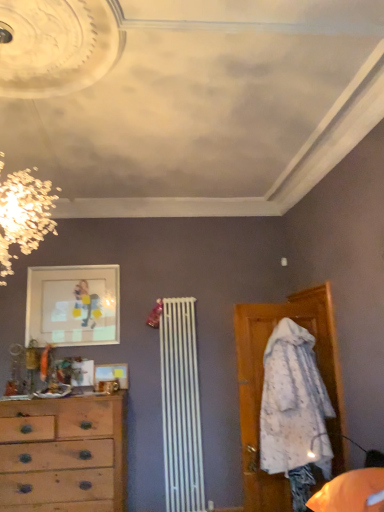
Question: Considering the positions of wooden picture frame at center, the 1th picture frame from the bottom, and wooden chest of drawers at left in the image, is wooden picture frame at center, the 1th picture frame from the bottom, taller or shorter than wooden chest of drawers at left?

Choices:
 (A) short
 (B) tall

Answer: (A)

Question: Looking at their shapes, would you say wooden picture frame at center, the 1th picture frame from the bottom, is wider or thinner than wooden chest of drawers at left?

Choices:
 (A) wide
 (B) thin

Answer: (B)

Question: Which of these objects is positioned farthest from the wooden chest of drawers at left?

Choices:
 (A) wooden picture frame at center, which is the 2th picture frame from top to bottom
 (B) matte glass picture frame at upper left, the 2th picture frame in the bottom-to-top sequence

Answer: (B)

Question: Estimate the real-world distances between objects in this image. Which object is farther from the matte glass picture frame at upper left, positioned as the 1th picture frame in top-to-bottom order?

Choices:
 (A) wooden chest of drawers at left
 (B) wooden picture frame at center, the 1th picture frame from the bottom

Answer: (A)